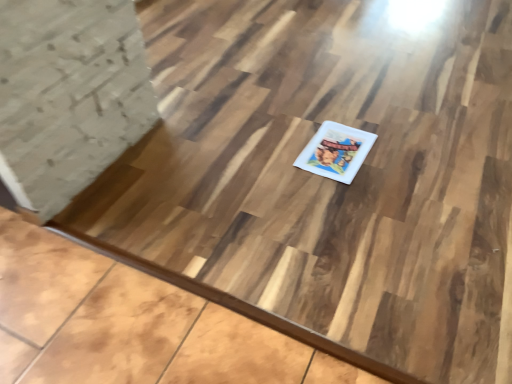
Find the location of a particular element. Image resolution: width=512 pixels, height=384 pixels. vacant space in white glossy book at center (from a real-world perspective) is located at coordinates (334, 150).